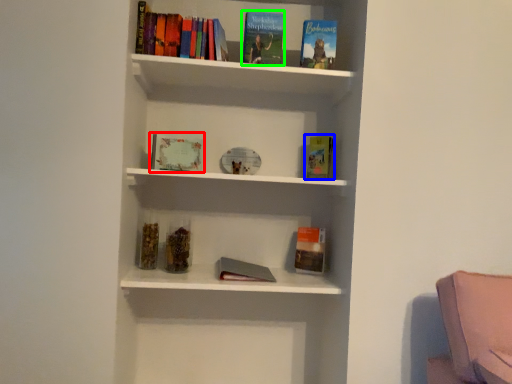
Question: Which is nearer to the book (highlighted by a red box)? paperback book (highlighted by a blue box) or book (highlighted by a green box).

Choices:
 (A) paperback book
 (B) book

Answer: (B)